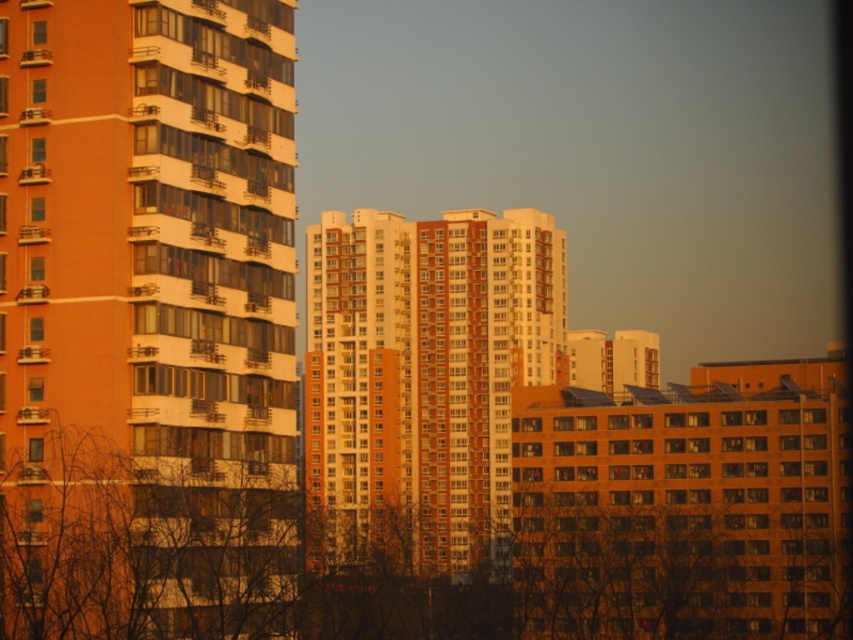
You are standing in the city and want to take a photo of the matte orange building at left and the orange brick building at center. Which building should you focus on first to ensure both are in the frame?

You should focus on the matte orange building at left first because it is closer to the viewer than the orange brick building at center, so adjusting the camera to include it will naturally include the latter in the frame as well.

You are a city planner analyzing the image. You need to determine which object occupies more vertical space in the scene. Based on the information provided, which one is taller between the matte orange building at left and the brown leafless branches at lower left?

→ The matte orange building at left is taller than the brown leafless branches at lower left according to the description.

You are an urban planner analyzing a cityscape image. You notice the matte orange building at left and the brown leafless branches at lower left. Which object takes up more area in the image?

Result: The brown leafless branches at lower left occupy more space than the matte orange building at left in the image.